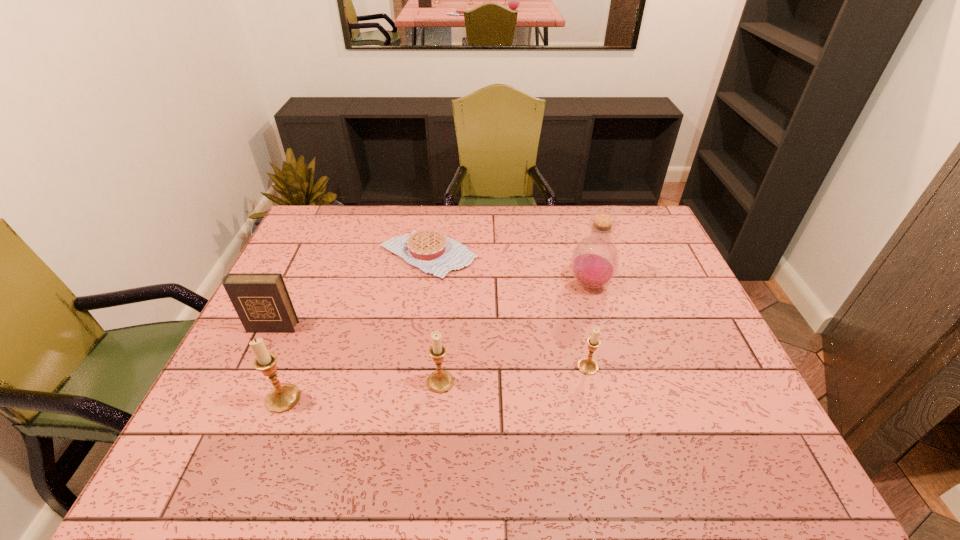
I want to click on vacant space at the left edge of the desktop, so pyautogui.click(x=276, y=339).

Where is `vacant region at the right edge of the desktop`? The width and height of the screenshot is (960, 540). vacant region at the right edge of the desktop is located at coordinates [656, 328].

At what (x,y) coordinates should I click in order to perform the action: click on vacant space at the near right corner of the desktop. Please return your answer as a coordinate pair (x, y). The width and height of the screenshot is (960, 540). Looking at the image, I should click on point(719,422).

Where is `vacant space that's between the second shortest candle holder and the diary`? vacant space that's between the second shortest candle holder and the diary is located at coordinates (356, 355).

The width and height of the screenshot is (960, 540). Identify the location of free spot between the second tallest candle holder and the bottle. (516, 333).

The width and height of the screenshot is (960, 540). In order to click on vacant space in between the second shortest candle holder and the diary in this screenshot , I will do `click(356, 355)`.

This screenshot has height=540, width=960. Find the location of `vacant space in between the second tallest candle holder and the bottle`. vacant space in between the second tallest candle holder and the bottle is located at coordinates (516, 333).

This screenshot has height=540, width=960. What are the coordinates of `blank region between the rightmost candle holder and the second candle holder from left to right` in the screenshot? It's located at (515, 374).

Where is `vacant space that is in between the second tallest candle holder and the shortest object`? The image size is (960, 540). vacant space that is in between the second tallest candle holder and the shortest object is located at coordinates tap(434, 319).

In order to click on vacant space that's between the diary and the leftmost candle holder in this screenshot , I will do [x=277, y=363].